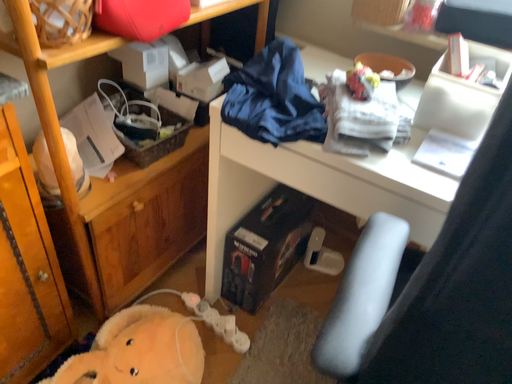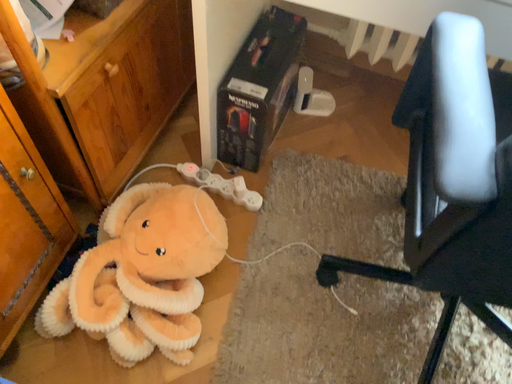
Question: How did the camera likely rotate when shooting the video?

Choices:
 (A) rotated right
 (B) rotated left

Answer: (A)